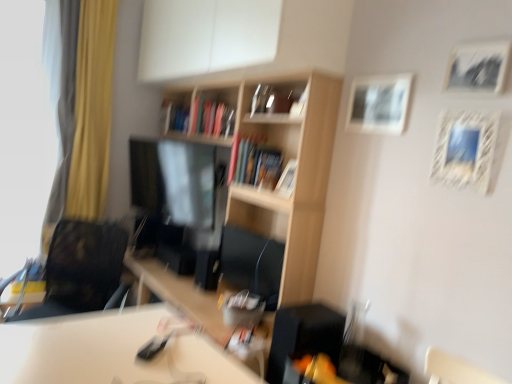
Question: Is white textured picture frame at upper right, the 3th picture frame from the back, a part of wooden picture frame at center, which is counted as the 1th picture frame, starting from the back?

Choices:
 (A) yes
 (B) no

Answer: (B)

Question: Is wooden picture frame at center, the 4th picture frame when ordered from front to back, aimed at white textured picture frame at upper right, the 3th picture frame from the back?

Choices:
 (A) yes
 (B) no

Answer: (B)

Question: Can you confirm if wooden picture frame at center, which ranks as the first picture frame in left-to-right order, is taller than white textured picture frame at upper right, arranged as the 2th picture frame when viewed from the right?

Choices:
 (A) no
 (B) yes

Answer: (A)

Question: From a real-world perspective, is wooden picture frame at center, which is counted as the 1th picture frame, starting from the back, located higher than white textured picture frame at upper right, positioned as the second picture frame in front-to-back order?

Choices:
 (A) no
 (B) yes

Answer: (A)

Question: Is wooden picture frame at center, which is counted as the 1th picture frame, starting from the back, smaller than white textured picture frame at upper right, arranged as the 2th picture frame when viewed from the right?

Choices:
 (A) no
 (B) yes

Answer: (A)

Question: Is white matte picture frame at upper right, placed as the 3th picture frame when sorted from right to left, wider or thinner than hardcover book at center, which appears as the first book when viewed from the back?

Choices:
 (A) thin
 (B) wide

Answer: (A)

Question: Visually, is white matte picture frame at upper right, the 2th picture frame viewed from the back, positioned to the left or to the right of hardcover book at center, which is the second book from right to left?

Choices:
 (A) right
 (B) left

Answer: (A)

Question: Considering the positions of white matte picture frame at upper right, placed as the 3th picture frame when sorted from right to left, and hardcover book at center, arranged as the second book when viewed from the front, in the image, is white matte picture frame at upper right, placed as the 3th picture frame when sorted from right to left, taller or shorter than hardcover book at center, arranged as the second book when viewed from the front,?

Choices:
 (A) short
 (B) tall

Answer: (A)

Question: Choose the correct answer: Is white matte picture frame at upper right, placed as the 3th picture frame when sorted from right to left, inside hardcover book at center, the 1th book when ordered from left to right, or outside it?

Choices:
 (A) inside
 (B) outside

Answer: (B)

Question: Is white matte cabinet at upper center situated inside yellow fabric curtain at left or outside?

Choices:
 (A) inside
 (B) outside

Answer: (B)

Question: Considering the positions of white matte cabinet at upper center and yellow fabric curtain at left in the image, is white matte cabinet at upper center taller or shorter than yellow fabric curtain at left?

Choices:
 (A) short
 (B) tall

Answer: (A)

Question: Does point (148, 3) appear closer or farther from the camera than point (106, 102)?

Choices:
 (A) closer
 (B) farther

Answer: (B)

Question: Would you say white matte cabinet at upper center is to the left or to the right of yellow fabric curtain at left in the picture?

Choices:
 (A) right
 (B) left

Answer: (A)

Question: Would you say hardcover book at center, the first book positioned from the right, is inside or outside white textured picture frame at upper right, marked as the 3th picture frame in a left-to-right arrangement?

Choices:
 (A) inside
 (B) outside

Answer: (B)

Question: From the image's perspective, is hardcover book at center, the 1th book when ordered from bottom to top, positioned above or below white textured picture frame at upper right, the 3th picture frame from the back?

Choices:
 (A) below
 (B) above

Answer: (B)